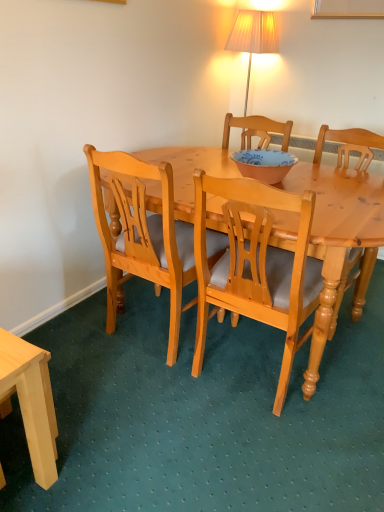
Question: Can you confirm if light brown wood chair at center, the first chair from the left, is taller than matte pink bowl at center?

Choices:
 (A) yes
 (B) no

Answer: (A)

Question: From a real-world perspective, is light brown wood chair at center, the first chair from the left, beneath matte pink bowl at center?

Choices:
 (A) no
 (B) yes

Answer: (B)

Question: From the image's perspective, would you say light brown wood chair at center, acting as the third chair starting from the right, is positioned over matte pink bowl at center?

Choices:
 (A) yes
 (B) no

Answer: (B)

Question: Is light brown wood chair at center, the first chair from the left, to the right of matte pink bowl at center from the viewer's perspective?

Choices:
 (A) no
 (B) yes

Answer: (A)

Question: Could matte pink bowl at center be considered to be inside light brown wood chair at center, acting as the third chair starting from the right?

Choices:
 (A) no
 (B) yes

Answer: (A)

Question: In the image, is light wood chair at center, which is counted as the 3th chair, starting from the left, on the left side or the right side of light wood desk at lower left?

Choices:
 (A) right
 (B) left

Answer: (A)

Question: From a real-world perspective, is light wood chair at center, which is the 1th chair from right to left, positioned above or below light wood desk at lower left?

Choices:
 (A) below
 (B) above

Answer: (B)

Question: Considering the positions of point (364, 265) and point (16, 389), is point (364, 265) closer or farther from the camera than point (16, 389)?

Choices:
 (A) closer
 (B) farther

Answer: (B)

Question: In terms of height, does light wood chair at center, which is the 1th chair from right to left, look taller or shorter compared to light wood desk at lower left?

Choices:
 (A) tall
 (B) short

Answer: (A)

Question: Would you say light wood chair at center, the second chair in the right-to-left sequence, is inside or outside light wood desk at lower left?

Choices:
 (A) inside
 (B) outside

Answer: (B)

Question: Visually, is light wood chair at center, which is counted as the second chair, starting from the left, positioned to the left or to the right of light wood desk at lower left?

Choices:
 (A) left
 (B) right

Answer: (B)

Question: Considering the positions of point (284, 284) and point (21, 402), is point (284, 284) closer or farther from the camera than point (21, 402)?

Choices:
 (A) farther
 (B) closer

Answer: (A)

Question: From the image's perspective, is light wood chair at center, which is counted as the second chair, starting from the left, positioned above or below light wood desk at lower left?

Choices:
 (A) above
 (B) below

Answer: (A)

Question: Do you think light wood desk at lower left is within light brown wood chair at center, the first chair from the left, or outside of it?

Choices:
 (A) inside
 (B) outside

Answer: (B)

Question: From the image's perspective, relative to light brown wood chair at center, acting as the third chair starting from the right, is light wood desk at lower left above or below?

Choices:
 (A) above
 (B) below

Answer: (B)